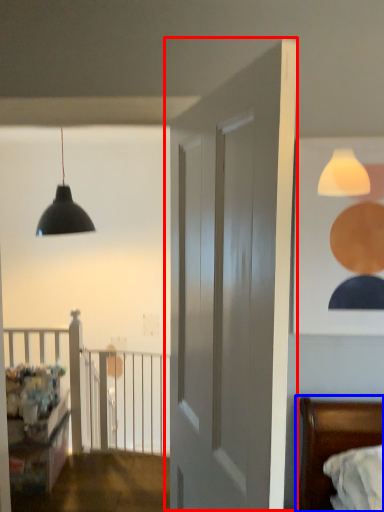
Question: Which point is closer to the camera, door (highlighted by a red box) or bed (highlighted by a blue box)?

Choices:
 (A) door
 (B) bed

Answer: (A)